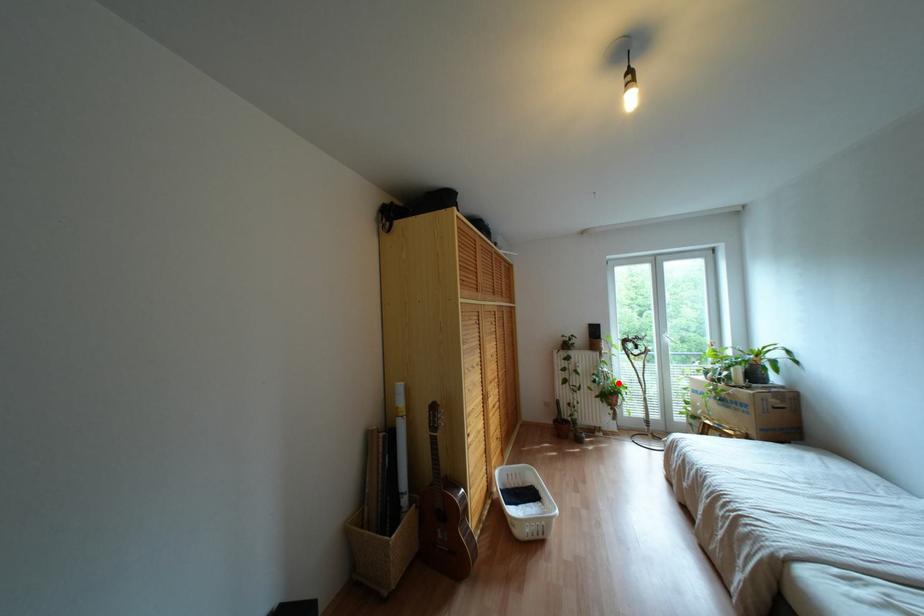
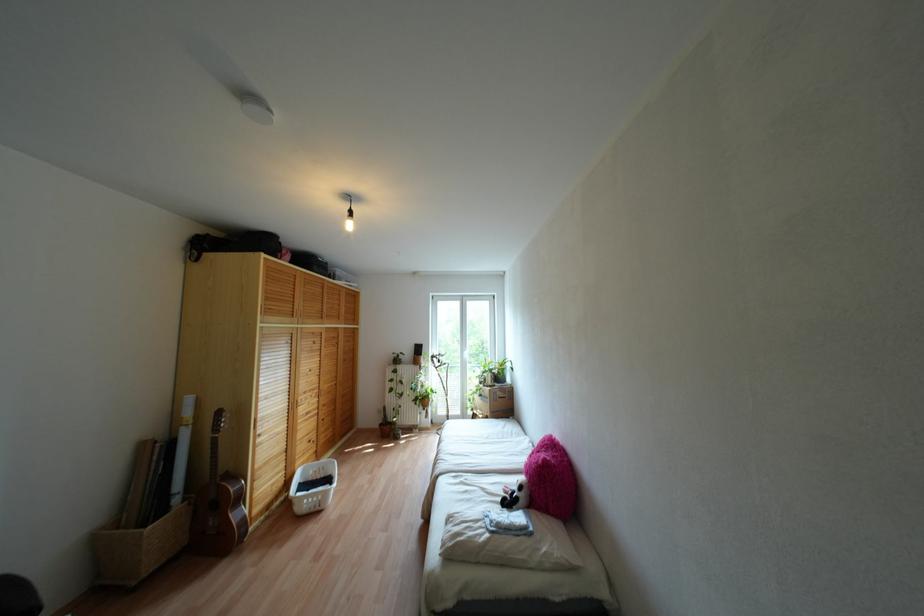
Where in the second image is the point corresponding to the highlighted location from the first image?

(431, 389)